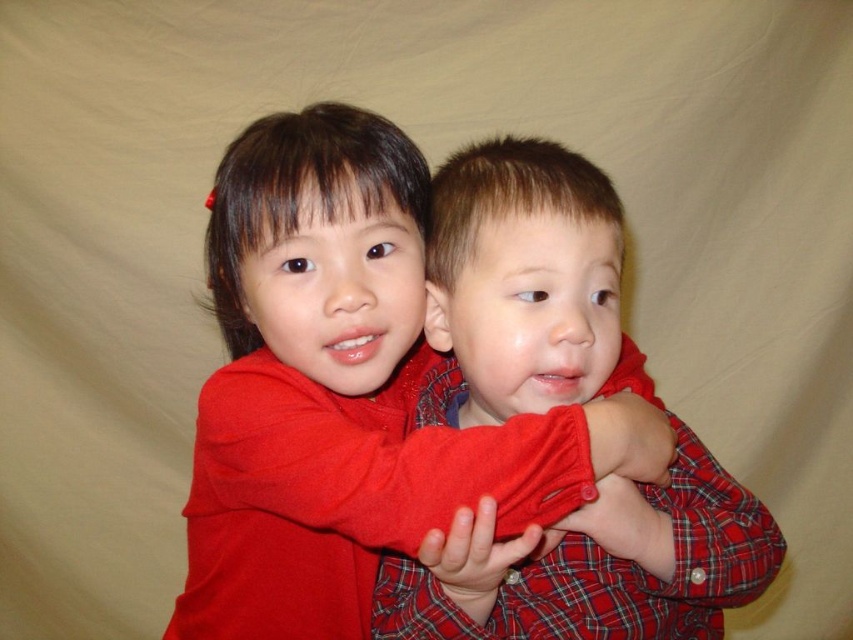
Question: Does matte red sweater at center come in front of plaid fabric shirt at center?

Choices:
 (A) no
 (B) yes

Answer: (A)

Question: Is matte red sweater at center to the left of plaid fabric shirt at center from the viewer's perspective?

Choices:
 (A) yes
 (B) no

Answer: (A)

Question: Which object is closer to the camera taking this photo?

Choices:
 (A) plaid fabric shirt at center
 (B) matte red sweater at center

Answer: (A)

Question: Among these points, which one is farthest from the camera?

Choices:
 (A) [x=622, y=355]
 (B) [x=323, y=173]

Answer: (A)

Question: Can you confirm if matte red sweater at center is positioned to the right of plaid fabric shirt at center?

Choices:
 (A) yes
 (B) no

Answer: (B)